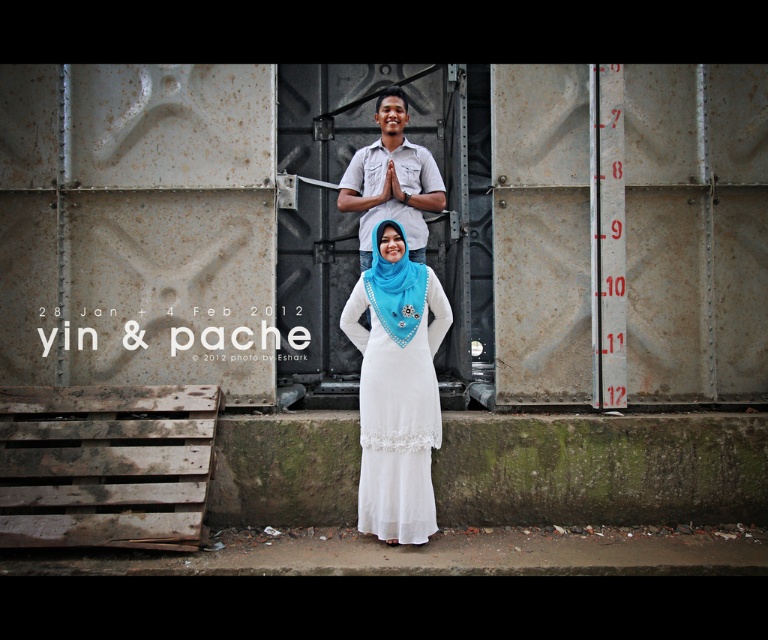
From the picture: You are a fashion designer observing the scene. You need to determine if the distance between the white sheer dress at center and the blue satin headscarf at center is sufficient to allow a 10 inch wide accessory to be placed between them without overlapping. Can you confirm this?

The white sheer dress at center is 10.22 inches from blue satin headscarf at center. Since the distance is 10.22 inches and the accessory requires 10 inches, there is enough space to place the accessory between them without overlapping.

You are a photographer trying to capture a portrait of both the matte white shirt at center and the blue satin headscarf at center in the scene. The camera can only focus on objects within a 20 inch range. Will both subjects be in focus?

The distance between the matte white shirt at center and the blue satin headscarf at center is 24.08 inches. Since the camera can only focus within a 20 inch range, the two subjects are slightly out of the focus range and may not both be in focus simultaneously.